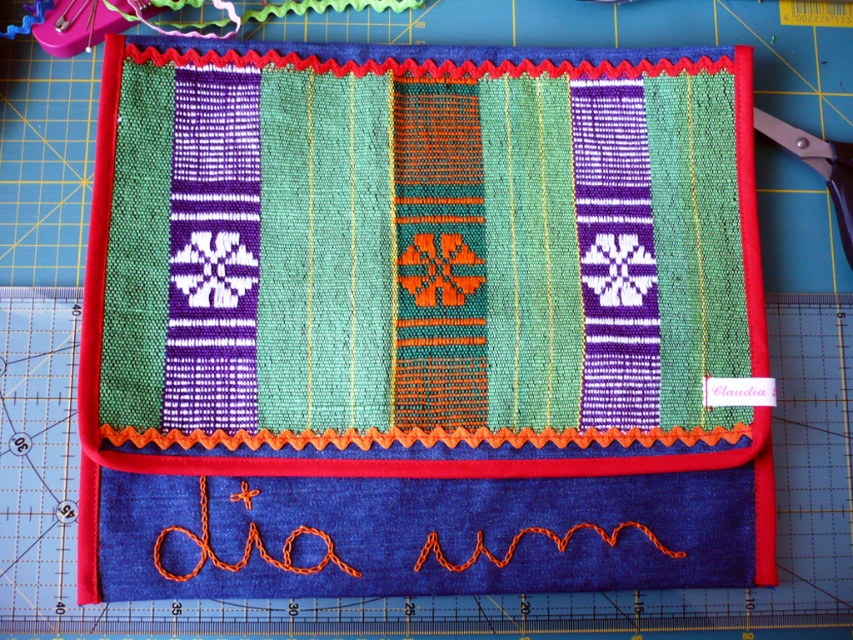
Which is above, textured fabric mat at center or black plastic scissors at upper right?

black plastic scissors at upper right

This screenshot has height=640, width=853. What do you see at coordinates (419, 323) in the screenshot? I see `textured fabric mat at center` at bounding box center [419, 323].

In order to click on textured fabric mat at center in this screenshot , I will do click(419, 323).